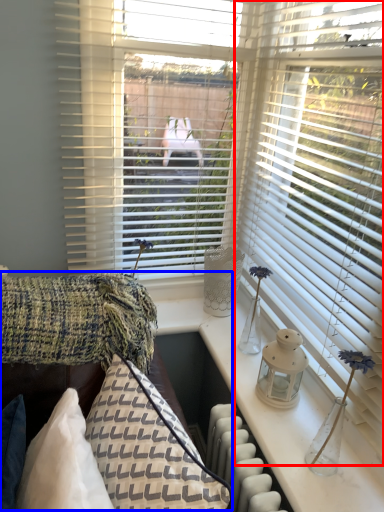
Question: Which point is further to the camera, window blind (highlighted by a red box) or couch (highlighted by a blue box)?

Choices:
 (A) window blind
 (B) couch

Answer: (A)